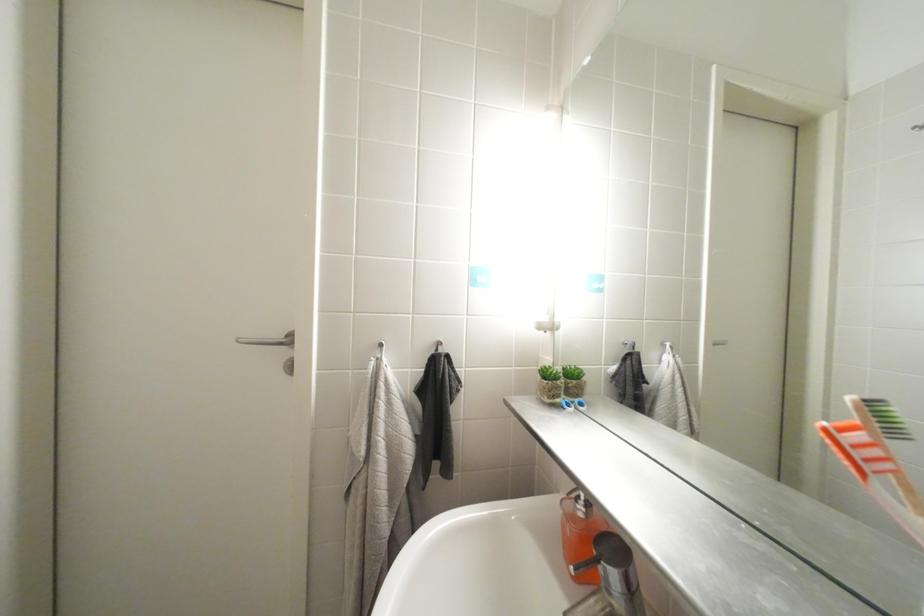
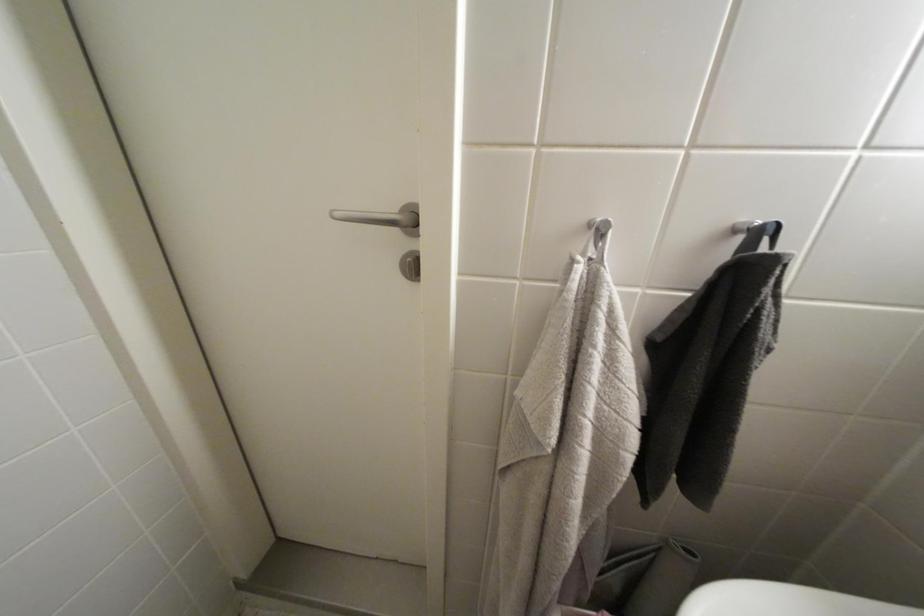
The images are taken continuously from a first-person perspective. In which direction are you moving?

The cameraman walked toward left, forward.